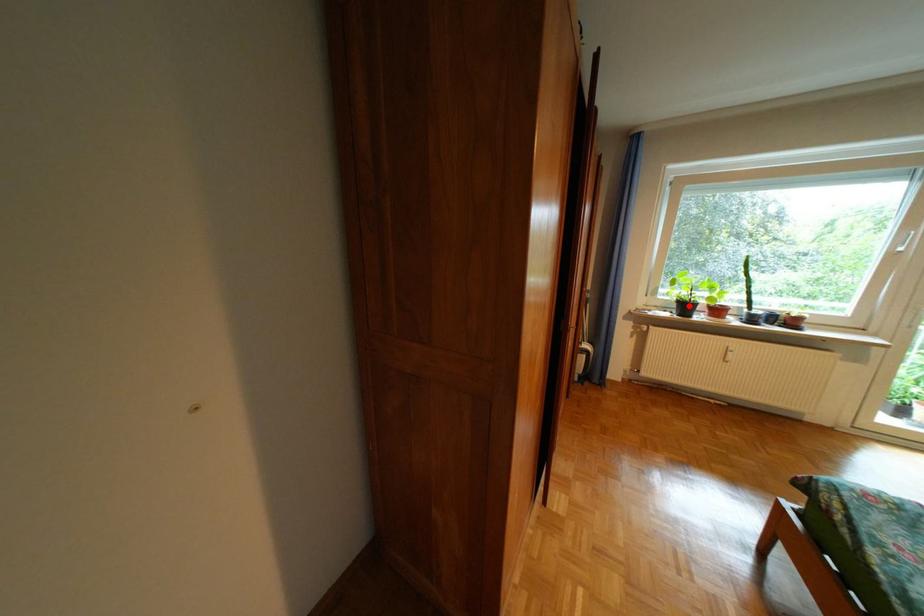
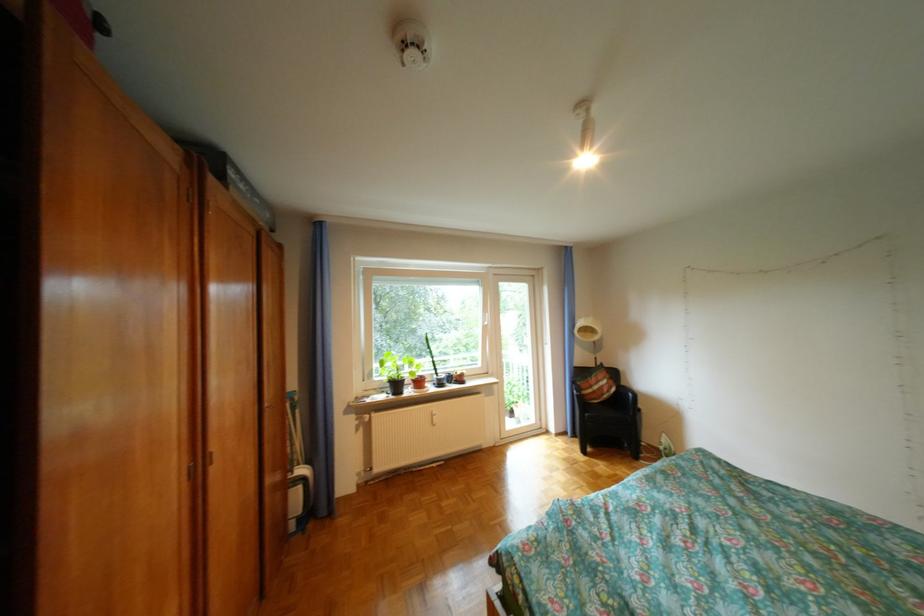
Question: I am providing you with two images of the same scene from different viewpoints. A red point is marked on the first image. At the location where the point appears in image 1, is it still visible in image 2?

Choices:
 (A) Yes
 (B) No

Answer: (A)